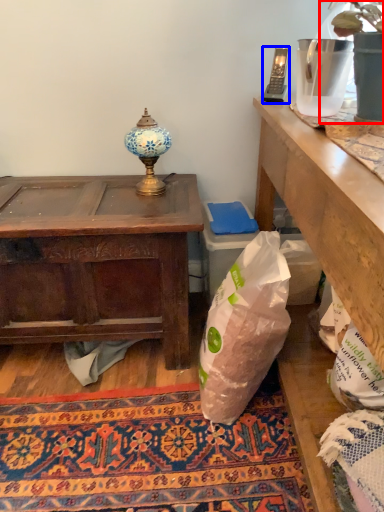
Question: Among these objects, which one is farthest to the camera, houseplant (highlighted by a red box) or mobile phone (highlighted by a blue box)?

Choices:
 (A) houseplant
 (B) mobile phone

Answer: (B)